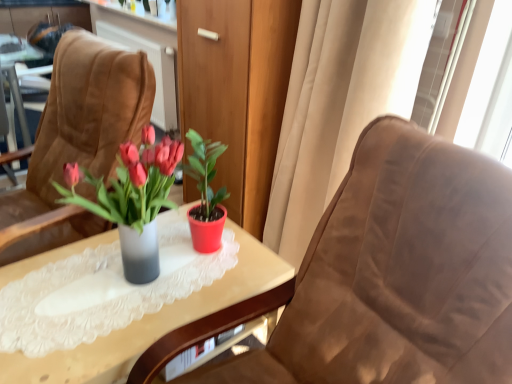
The image size is (512, 384). What are the coordinates of `free space in front of matte plastic vase at center` in the screenshot? It's located at (84, 333).